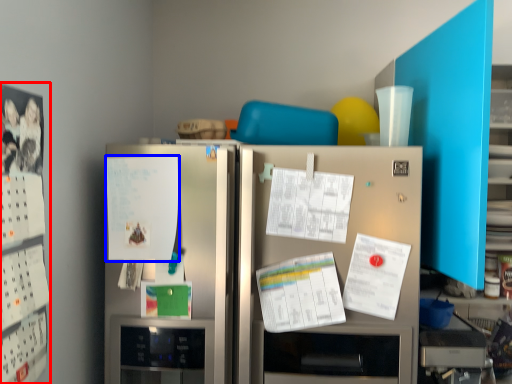
Question: Which object appears farthest to the camera in this image, bulletin board (highlighted by a red box) or poster (highlighted by a blue box)?

Choices:
 (A) bulletin board
 (B) poster

Answer: (B)